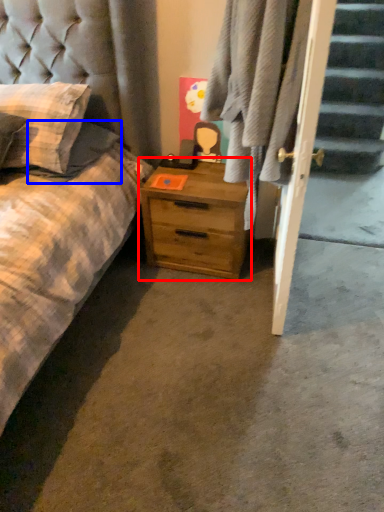
Question: Among these objects, which one is farthest to the camera, nightstand (highlighted by a red box) or pillow (highlighted by a blue box)?

Choices:
 (A) nightstand
 (B) pillow

Answer: (A)